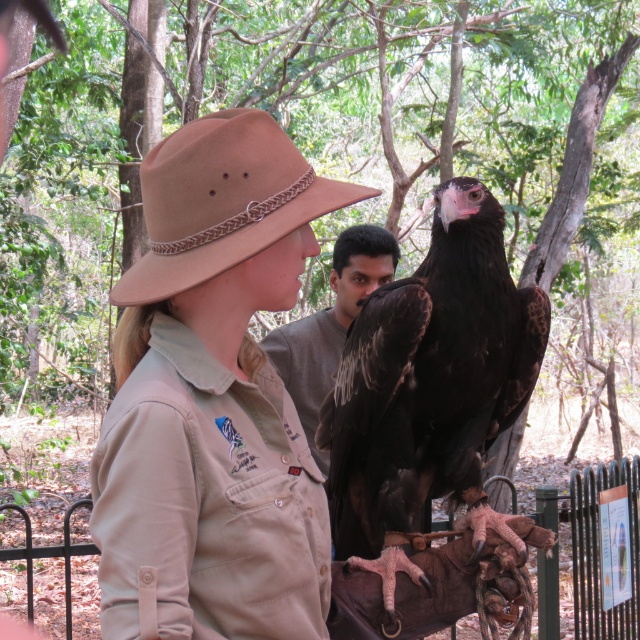
You are standing in a forest and see two points in the scene. The first point is at coordinate point (x=362, y=188) and the second is at point (x=499, y=284). Which point is closer to you?

Point (x=362, y=188) is closer to the viewer than point (x=499, y=284).

You are a photographer trying to capture a clear shot of the dark brown feathers at center and the dark gray shirt at center. Based on their positions, which one is closer to the camera?

The dark brown feathers at center is located below the dark gray shirt at center, so the dark brown feathers at center is closer to the camera.